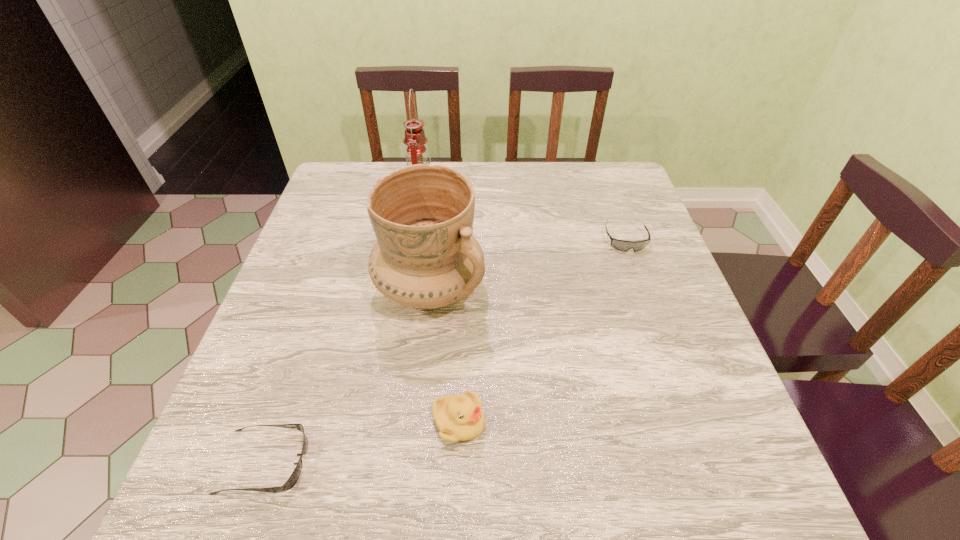
Where is `vacant point at the near left corner`? The image size is (960, 540). vacant point at the near left corner is located at coordinates (259, 468).

In the image, there is a desktop. In order to click on free space at the far right corner in this screenshot , I will do `click(588, 173)`.

Locate an element on the screen. Image resolution: width=960 pixels, height=540 pixels. vacant point located between the rightmost object and the pottery is located at coordinates (527, 264).

At what (x,y) coordinates should I click in order to perform the action: click on free space between the duckling and the rightmost object. Please return your answer as a coordinate pair (x, y). The image size is (960, 540). Looking at the image, I should click on (542, 330).

You are a GUI agent. You are given a task and a screenshot of the screen. Output one action in this format:
    pyautogui.click(x=<x>, y=<y>)
    Task: Click on the free space between the oil lamp and the rightmost object
    
    Given the screenshot: What is the action you would take?
    pyautogui.click(x=523, y=215)

Locate an element on the screen. The width and height of the screenshot is (960, 540). vacant area that lies between the oil lamp and the leftmost object is located at coordinates (343, 326).

What are the coordinates of `vacant area between the oil lamp and the sunglasses` in the screenshot? It's located at (343, 326).

Where is `free point between the pottery and the sunglasses`? free point between the pottery and the sunglasses is located at coordinates (347, 375).

Identify the location of free space between the duckling and the leftmost object. (362, 442).

Where is `vacant area that lies between the duckling and the rightmost object`? vacant area that lies between the duckling and the rightmost object is located at coordinates (542, 330).